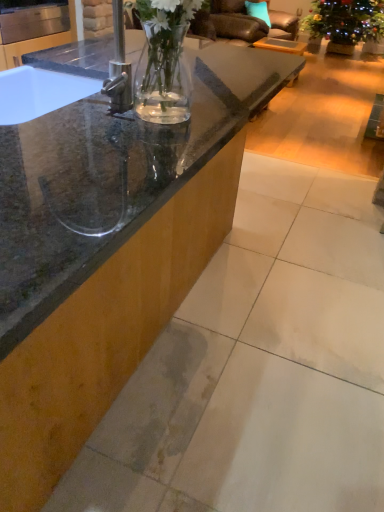
Question: Is green leafy plant at upper right far away from translucent glass sink at upper left?

Choices:
 (A) no
 (B) yes

Answer: (B)

Question: Is green leafy plant at upper right behind translucent glass sink at upper left?

Choices:
 (A) no
 (B) yes

Answer: (B)

Question: Is green leafy plant at upper right thinner than translucent glass sink at upper left?

Choices:
 (A) yes
 (B) no

Answer: (B)

Question: Is green leafy plant at upper right shorter than translucent glass sink at upper left?

Choices:
 (A) no
 (B) yes

Answer: (A)

Question: From a real-world perspective, is green leafy plant at upper right on translucent glass sink at upper left?

Choices:
 (A) no
 (B) yes

Answer: (A)

Question: Does green leafy plant at upper right lie in front of translucent glass sink at upper left?

Choices:
 (A) no
 (B) yes

Answer: (A)

Question: From the image's perspective, is teal fabric pillow at upper center on top of leather armchair at upper center?

Choices:
 (A) no
 (B) yes

Answer: (B)

Question: Can you confirm if teal fabric pillow at upper center is thinner than leather armchair at upper center?

Choices:
 (A) no
 (B) yes

Answer: (B)

Question: From a real-world perspective, is teal fabric pillow at upper center physically below leather armchair at upper center?

Choices:
 (A) yes
 (B) no

Answer: (B)

Question: Can leather armchair at upper center be found inside teal fabric pillow at upper center?

Choices:
 (A) yes
 (B) no

Answer: (B)

Question: Can you confirm if teal fabric pillow at upper center is smaller than leather armchair at upper center?

Choices:
 (A) no
 (B) yes

Answer: (B)

Question: Would you say teal fabric pillow at upper center is outside leather armchair at upper center?

Choices:
 (A) yes
 (B) no

Answer: (B)

Question: Is green leafy plant at upper right looking in the opposite direction of teal fabric pillow at upper center?

Choices:
 (A) no
 (B) yes

Answer: (A)